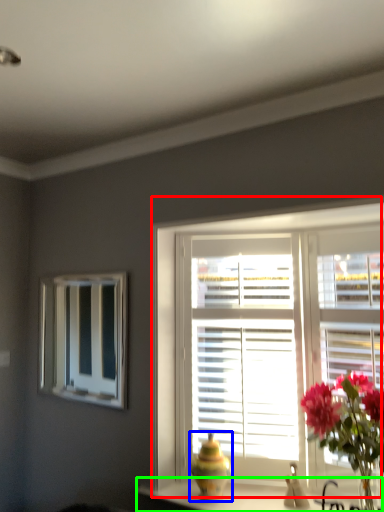
Question: Which object is the closest to the window (highlighted by a red box)? Choose among these: vase (highlighted by a blue box) or counter top (highlighted by a green box).

Choices:
 (A) vase
 (B) counter top

Answer: (A)